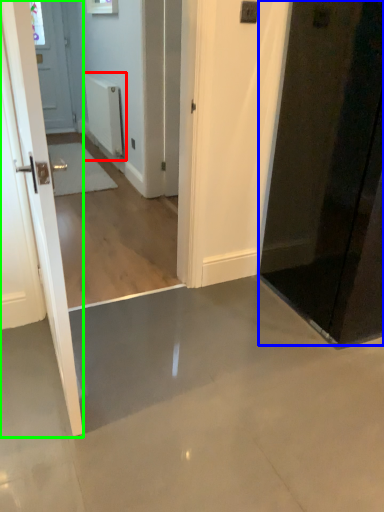
Question: Estimate the real-world distances between objects in this image. Which object is closer to radiator (highlighted by a red box), door (highlighted by a blue box) or door (highlighted by a green box)?

Choices:
 (A) door
 (B) door

Answer: (A)